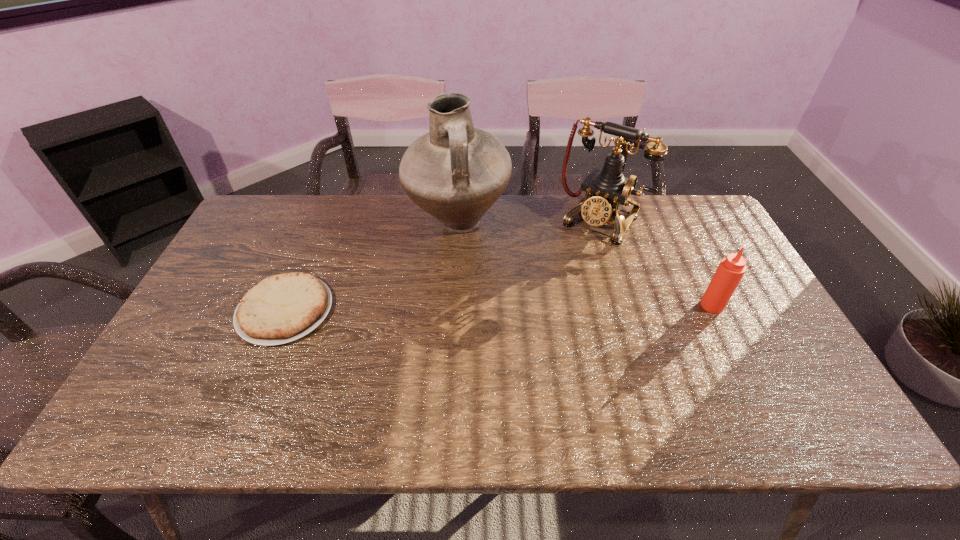
This screenshot has height=540, width=960. I want to click on vacant space located 0.210m on the handle side of the pitcher, so click(x=513, y=301).

I want to click on vacant space situated on the handle side of the pitcher, so click(x=536, y=333).

This screenshot has width=960, height=540. I want to click on vacant region located 0.180m on the handle side of the pitcher, so click(508, 294).

I want to click on free space located 0.260m on the front of the telephone, featuring the rotary dial, so click(548, 295).

The width and height of the screenshot is (960, 540). In order to click on free space located 0.210m on the front of the telephone, featuring the rotary dial in this screenshot , I will do `click(556, 285)`.

I want to click on blank space located on the front of the telephone, featuring the rotary dial, so click(x=534, y=317).

Identify the location of pitcher that is at the far edge. (455, 172).

Where is `telephone at the far edge`? The image size is (960, 540). telephone at the far edge is located at coordinates (607, 190).

I want to click on object situated at the left edge, so click(282, 308).

Find the location of a particular element. This screenshot has width=960, height=540. object present at the right edge is located at coordinates (731, 269).